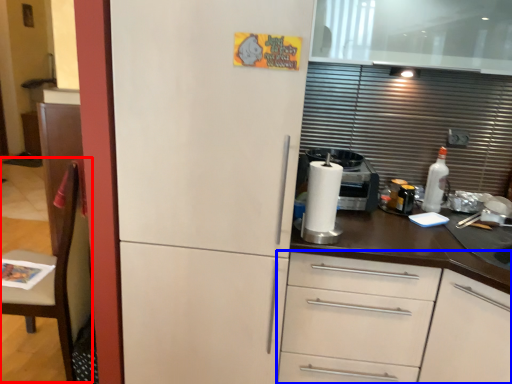
Question: Which of the following is the farthest to the observer, chair (highlighted by a red box) or cabinetry (highlighted by a blue box)?

Choices:
 (A) chair
 (B) cabinetry

Answer: (A)